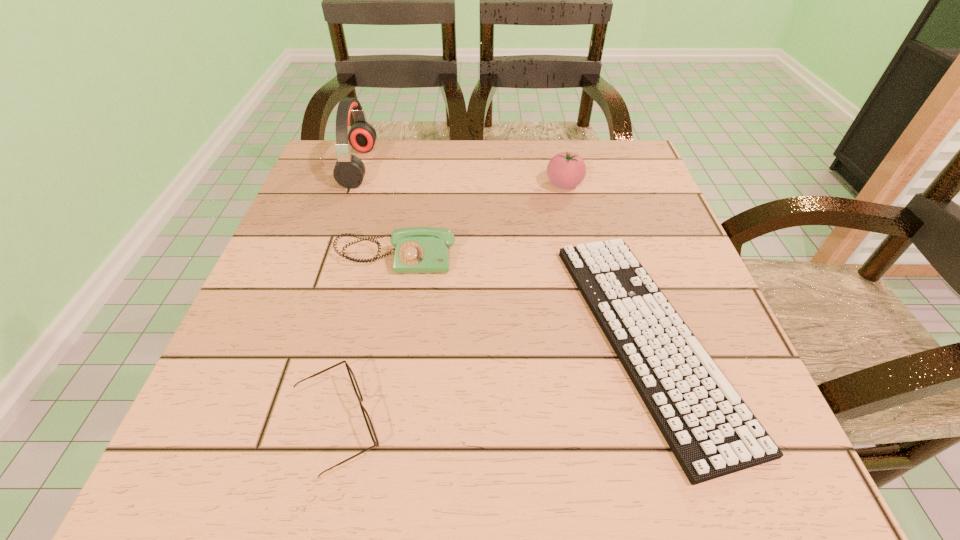
Where is `earphone that is at the far edge`? earphone that is at the far edge is located at coordinates (349, 170).

Find the location of a particular element. tomato at the far edge is located at coordinates (565, 170).

At what (x,y) coordinates should I click in order to perform the action: click on spectacles located in the near edge section of the desktop. Please return your answer as a coordinate pair (x, y). Image resolution: width=960 pixels, height=540 pixels. Looking at the image, I should click on (369, 424).

The width and height of the screenshot is (960, 540). Find the location of `computer keyboard located in the near edge section of the desktop`. computer keyboard located in the near edge section of the desktop is located at coordinates (711, 431).

This screenshot has height=540, width=960. Identify the location of earphone that is at the left edge. (349, 170).

At what (x,y) coordinates should I click in order to perform the action: click on telephone situated at the left edge. Please return your answer as a coordinate pair (x, y). The width and height of the screenshot is (960, 540). Looking at the image, I should click on (417, 249).

This screenshot has height=540, width=960. What are the coordinates of `spectacles that is at the left edge` in the screenshot? It's located at (369, 424).

Image resolution: width=960 pixels, height=540 pixels. Identify the location of tomato present at the right edge. (565, 170).

Find the location of a particular element. computer keyboard that is at the right edge is located at coordinates (711, 431).

Find the location of a particular element. Image resolution: width=960 pixels, height=540 pixels. object situated at the far left corner is located at coordinates (349, 170).